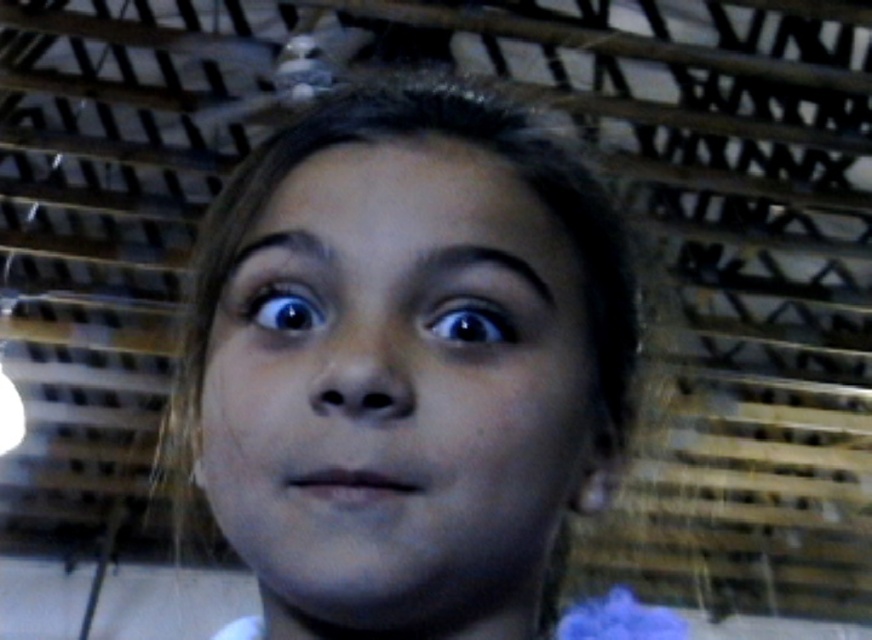
You are a photographer adjusting lighting for a portrait. You notice the smooth skin face at center and the blue glossy eye at center in your frame. Which object would you need to focus on more carefully to avoid overexposure due to its reflective surface?

The blue glossy eye at center has a reflective surface, so you should focus more carefully on it to avoid overexposure.

You are an artist sketching the person in the image. You need to draw the smooth skin face at center and the black glossy eye at center. Based on their positions, which one should you draw first?

The smooth skin face at center should be drawn first because the black glossy eye at center is positioned above it, meaning the face is lower and would form the base for the eye.

You are a photographer adjusting the lighting in a dimly lit room. You need to ensure that both the smooth skin face at center and the blue glossy eye at center are well illuminated. Which object should you focus the light on first to ensure proper exposure?

The smooth skin face at center is below the blue glossy eye at center, so focusing the light on the blue glossy eye at center first will help ensure both areas are properly illuminated as the face is positioned lower and may require additional light to counteract shadows.